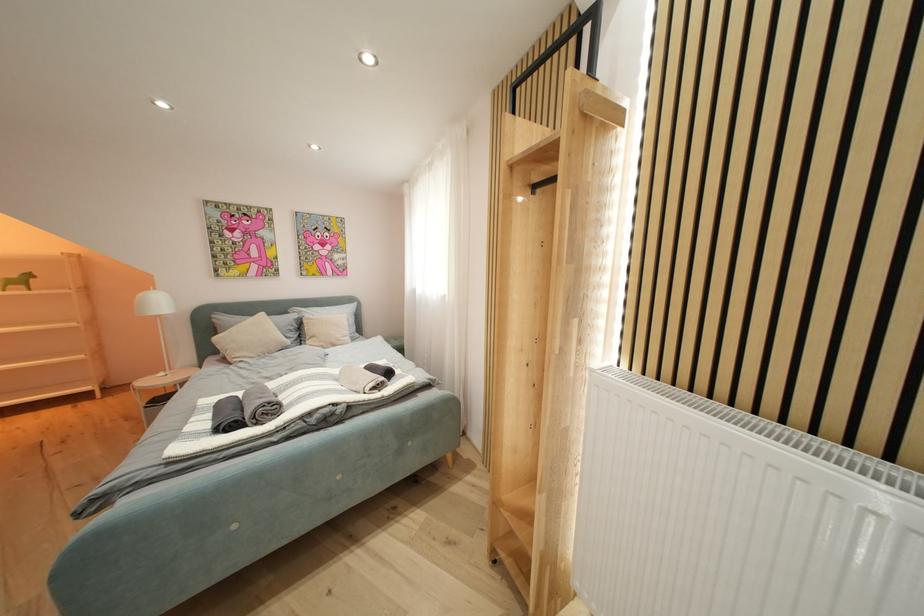
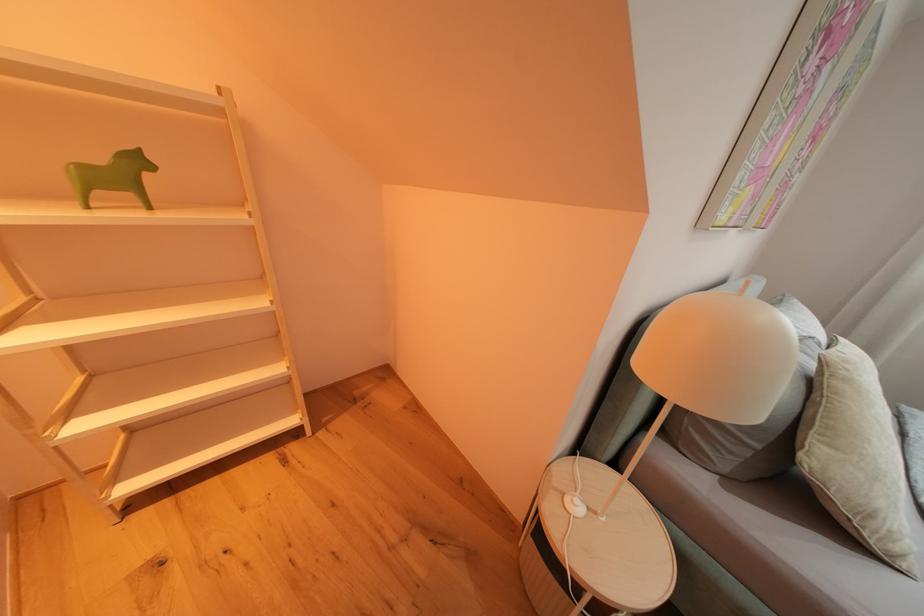
Which direction would the cameraman need to move to produce the second image?

The movement direction of the cameraman is left, forward.